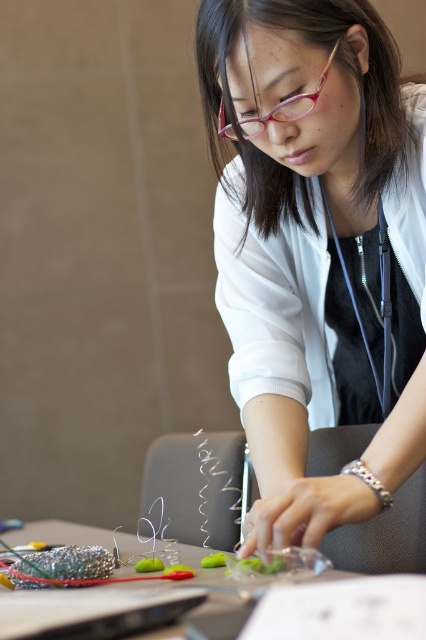
Question: Is white matte shirt at center wider than clear plastic table at lower center?

Choices:
 (A) yes
 (B) no

Answer: (B)

Question: Can you confirm if white matte shirt at center is positioned to the left of clear plastic table at lower center?

Choices:
 (A) yes
 (B) no

Answer: (B)

Question: Which point appears farthest from the camera in this image?

Choices:
 (A) (371, 60)
 (B) (276, 593)

Answer: (A)

Question: Does white matte shirt at center have a greater width compared to clear plastic table at lower center?

Choices:
 (A) no
 (B) yes

Answer: (A)

Question: Which point is farther to the camera?

Choices:
 (A) clear plastic table at lower center
 (B) white matte shirt at center

Answer: (B)

Question: Which object is closer to the camera taking this photo?

Choices:
 (A) white matte shirt at center
 (B) clear plastic table at lower center

Answer: (B)